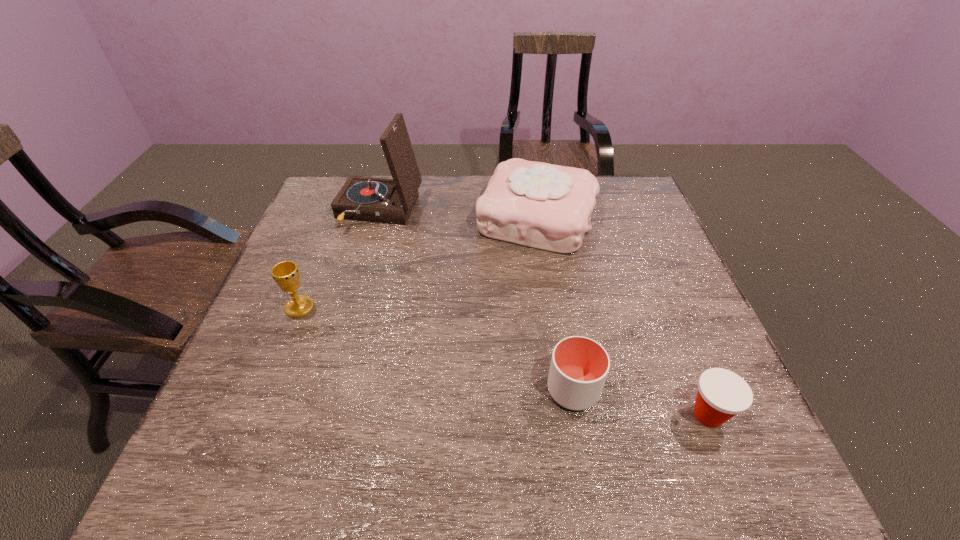
Where is `free space at the right edge`? free space at the right edge is located at coordinates (645, 338).

The width and height of the screenshot is (960, 540). Identify the location of vacant point at the far right corner. (625, 188).

The width and height of the screenshot is (960, 540). Identify the location of empty space that is in between the cake and the tallest object. (458, 214).

Find the location of a particular element. This screenshot has width=960, height=540. free point between the cup and the tallest object is located at coordinates (476, 300).

Identify the location of free space between the third farthest object and the cake. (418, 262).

You are a GUI agent. You are given a task and a screenshot of the screen. Output one action in this format:
    pyautogui.click(x=<x>, y=<y>)
    Task: Click on the blank region between the tallest object and the shortest object
    The height and width of the screenshot is (540, 960).
    Given the screenshot: What is the action you would take?
    pyautogui.click(x=543, y=313)

The width and height of the screenshot is (960, 540). I want to click on vacant region between the tallest object and the cup, so click(x=476, y=300).

Identify the location of vacant space in between the shortest object and the third nearest object. (504, 361).

The image size is (960, 540). Identify the location of vacant region between the cake and the chalice. (418, 262).

At what (x,y) coordinates should I click in order to perform the action: click on unoccupied position between the cake and the phonograph record. Please return your answer as a coordinate pair (x, y). This screenshot has width=960, height=540. Looking at the image, I should click on tap(458, 214).